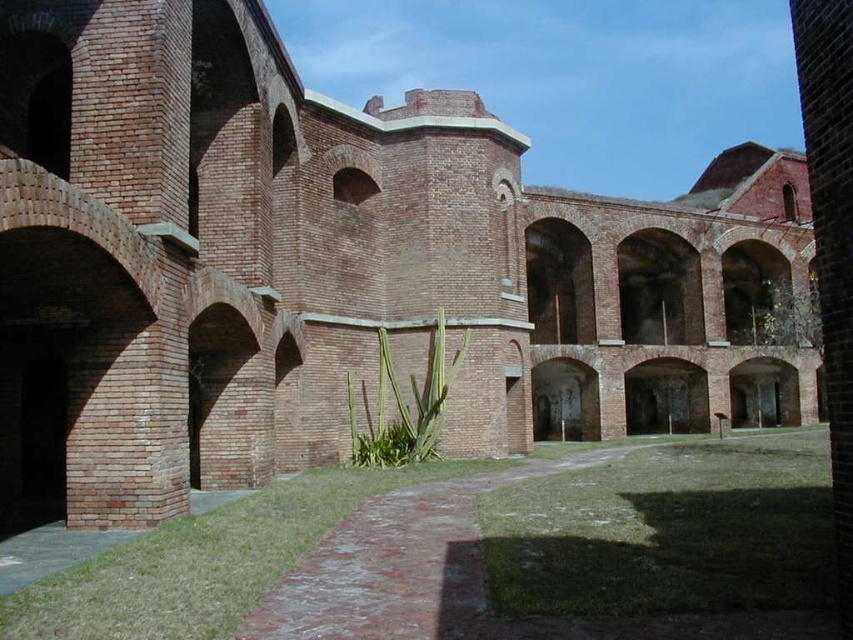
Question: Can you confirm if green grass at center is bigger than smooth brick archway at center?

Choices:
 (A) no
 (B) yes

Answer: (B)

Question: Does smooth brick archway at center come in front of brick archway at center?

Choices:
 (A) yes
 (B) no

Answer: (A)

Question: Among these objects, which one is nearest to the camera?

Choices:
 (A) green grass at center
 (B) smooth brick archway at center
 (C) brick archway at center

Answer: (A)

Question: Does smooth brick archway at center appear on the left side of brick archway at center?

Choices:
 (A) no
 (B) yes

Answer: (B)

Question: Among these points, which one is farthest from the camera?

Choices:
 (A) (756, 410)
 (B) (677, 550)

Answer: (A)

Question: Which of the following is the farthest from the observer?

Choices:
 (A) green grass at center
 (B) brick archway at center

Answer: (B)